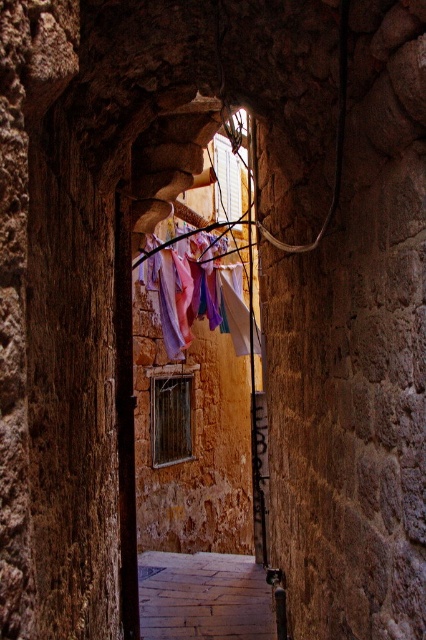
You are standing in the alley and see the smooth stone alley at center and the pastel fabric at center. Which object is positioned to the right of the other?

The smooth stone alley at center is to the right of the pastel fabric at center.

You are a delivery person carrying a box that is 1.2 meters wide. You need to pass through the narrow alleyway. Can you fit through the alleyway if you walk along the smooth stone alley at center and the pastel fabric at center?

The smooth stone alley at center is narrower than the pastel fabric at center. Since the alleyway is narrower than the fabric, and your box is 1.2 meters wide, you need to compare the alley width with your box. However, the exact width of the alley isn not provided. Without knowing the alley width, it is impossible to determine if the box will fit. Please check the alley width first.

You are standing in the narrow alleyway between the weathered stone walls. You notice two points marked on the wall. The first point is at coordinates point (157, 614) and the second is at point (245, 317). Which of these points is closer to you?

Point (157, 614) is closer to the viewer than point (245, 317).